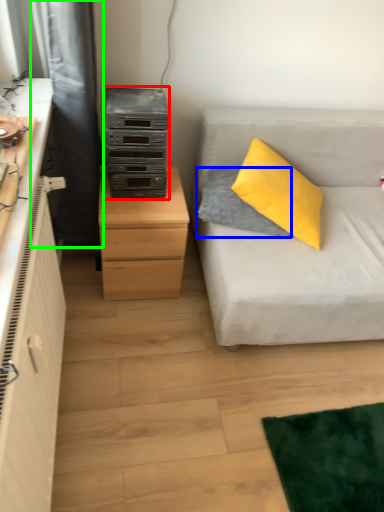
Question: Based on their relative distances, which object is farther from stereo (highlighted by a red box)? Choose from pillow (highlighted by a blue box) and curtain (highlighted by a green box).

Choices:
 (A) pillow
 (B) curtain

Answer: (A)